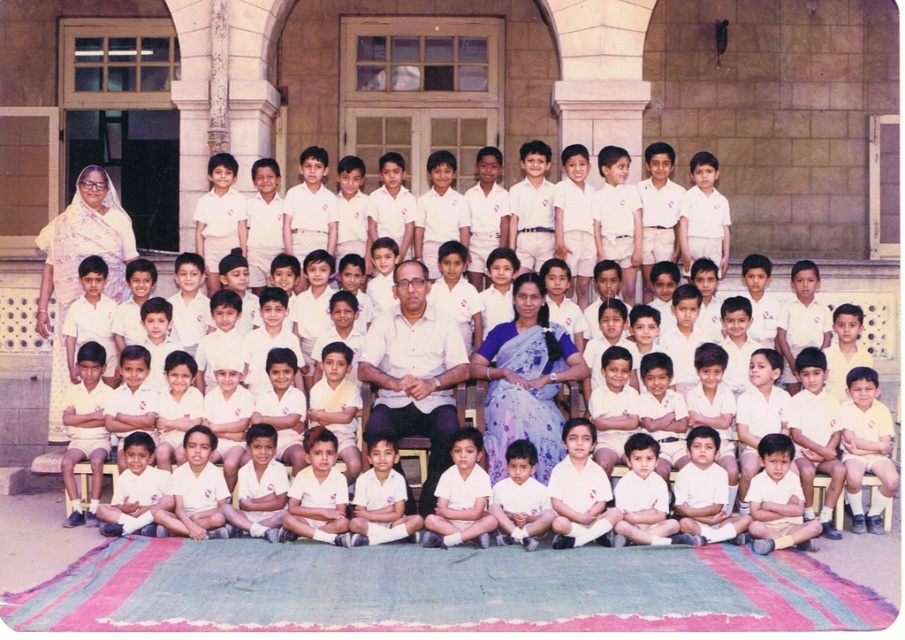
Question: Can you confirm if white matte shirt at center is positioned to the right of white cotton shirt at center?

Choices:
 (A) yes
 (B) no

Answer: (B)

Question: Which object appears closest to the camera in this image?

Choices:
 (A) white cotton shirt at center
 (B) purple floral saree at center

Answer: (A)

Question: Is purple floral saree at center closer to camera compared to white cotton shirt at center?

Choices:
 (A) yes
 (B) no

Answer: (B)

Question: Which point is farther to the camera?

Choices:
 (A) white cotton shirt at center
 (B) white printed saree at upper left
 (C) white matte shirt at center

Answer: (B)

Question: Can you confirm if purple floral saree at center is smaller than white printed saree at upper left?

Choices:
 (A) yes
 (B) no

Answer: (A)

Question: Which object is the closest to the white printed saree at upper left?

Choices:
 (A) white matte shirt at center
 (B) white cotton shirt at center
 (C) purple floral saree at center

Answer: (B)